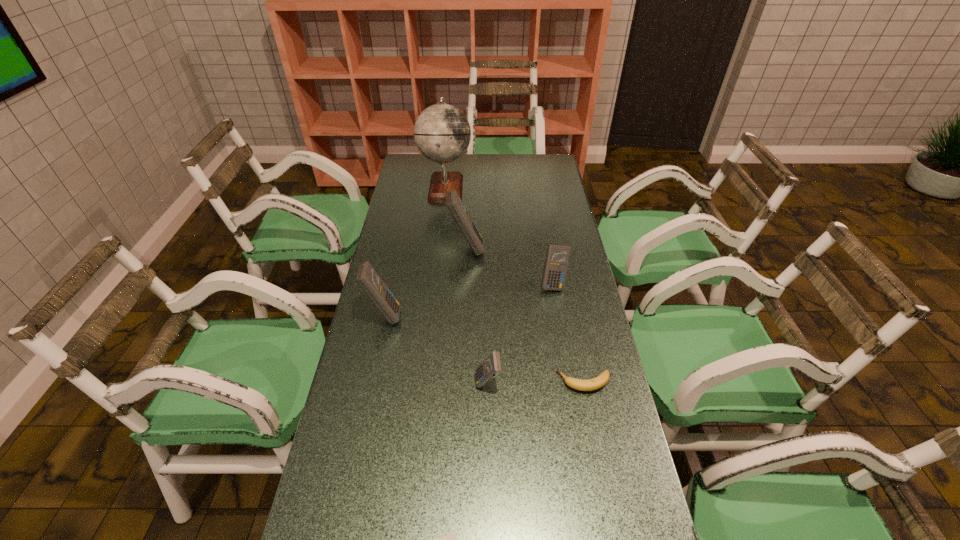
Locate an element on the screen. The height and width of the screenshot is (540, 960). vacant space situated at the stem of the sixth tallest object is located at coordinates (444, 382).

You are a GUI agent. You are given a task and a screenshot of the screen. Output one action in this format:
    pyautogui.click(x=<x>, y=<y>)
    Task: Click on the free space located at the stem of the sixth tallest object
    Image resolution: width=960 pixels, height=540 pixels.
    Given the screenshot: What is the action you would take?
    click(522, 382)

Where is `object at the far edge`? This screenshot has width=960, height=540. object at the far edge is located at coordinates (442, 133).

Identify the location of globe situated at the left edge. This screenshot has width=960, height=540. (442, 133).

Where is `calculator at the left edge`? calculator at the left edge is located at coordinates (367, 278).

The width and height of the screenshot is (960, 540). Find the location of `calculator located in the right edge section of the desktop`. calculator located in the right edge section of the desktop is located at coordinates (557, 257).

The width and height of the screenshot is (960, 540). In order to click on banana that is at the right edge in this screenshot , I will do `click(596, 383)`.

Where is `object positioned at the far left corner`? This screenshot has height=540, width=960. object positioned at the far left corner is located at coordinates (442, 133).

Locate an element on the screen. This screenshot has width=960, height=540. vacant space at the left edge is located at coordinates (394, 372).

Find the location of a particular element. This screenshot has width=960, height=540. vacant area at the right edge of the desktop is located at coordinates (541, 210).